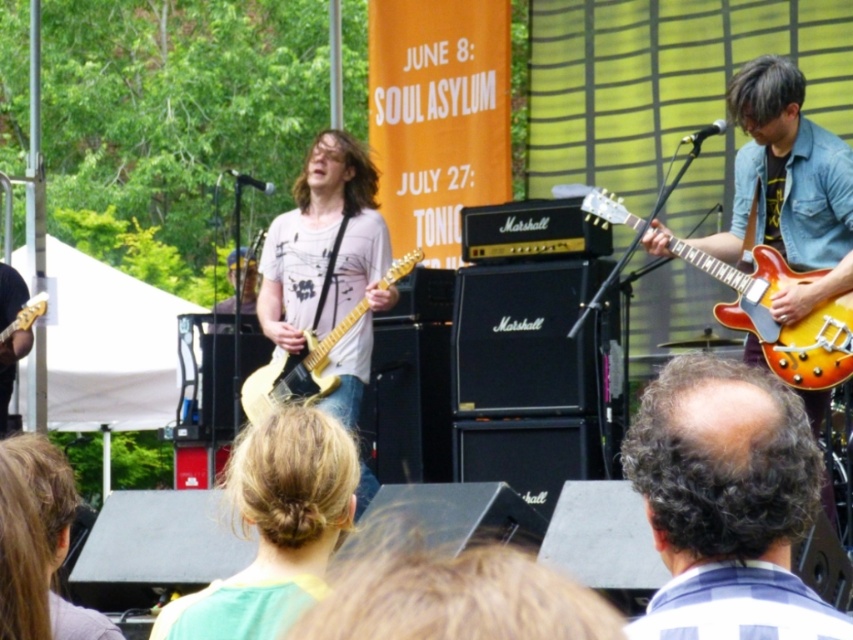
Is dark brown curly hair at center positioned in front of matte gold electric guitar at center?

Yes.

This screenshot has width=853, height=640. Describe the element at coordinates (726, 502) in the screenshot. I see `dark brown curly hair at center` at that location.

Image resolution: width=853 pixels, height=640 pixels. I want to click on dark brown curly hair at center, so [726, 502].

Can you confirm if matte yellow guitar at right is shorter than sunburst wood electric guitar at right?

Incorrect, matte yellow guitar at right's height does not fall short of sunburst wood electric guitar at right's.

Measure the distance between point (830,212) and camera.

They are 32.64 feet apart.

This screenshot has height=640, width=853. In order to click on matte yellow guitar at right in this screenshot , I will do `click(787, 186)`.

Does blonde hair at center appear under matte gold electric guitar at center?

Correct, blonde hair at center is located below matte gold electric guitar at center.

Is blonde hair at center thinner than matte gold electric guitar at center?

Yes.

Which is behind, point (332, 476) or point (305, 400)?

Positioned behind is point (305, 400).

The width and height of the screenshot is (853, 640). In order to click on blonde hair at center in this screenshot , I will do `click(276, 529)`.